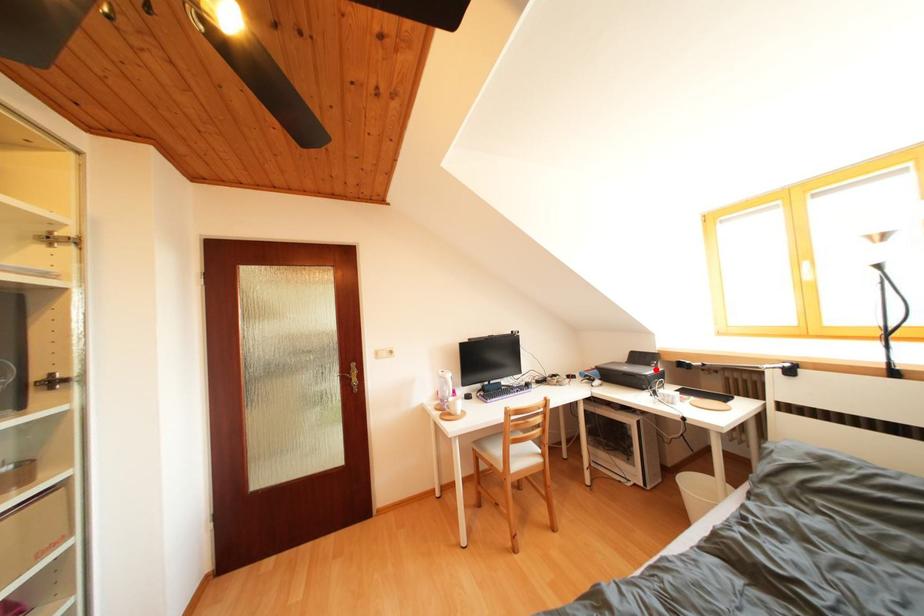
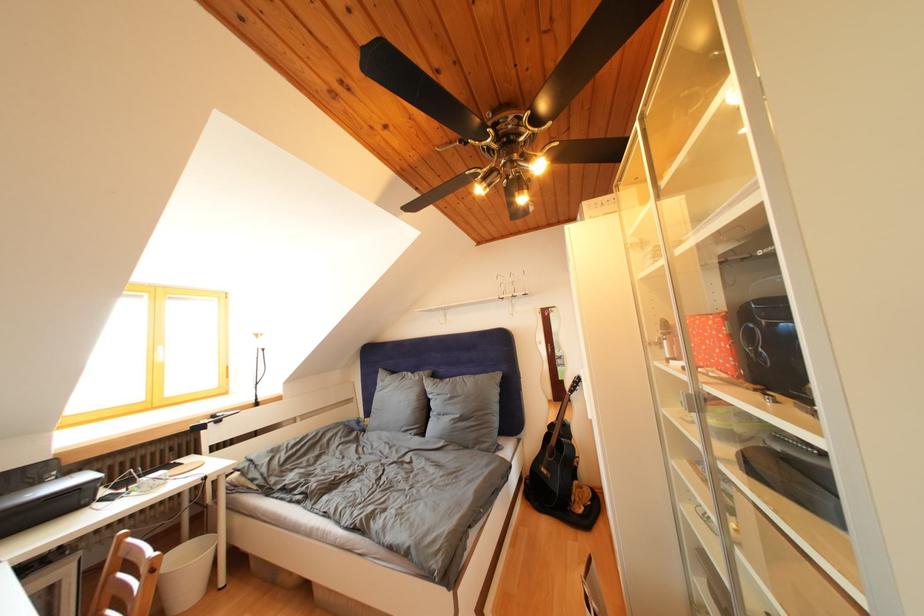
In the second image, find the point that corresponds to the highlighted location in the first image.

(44, 488)